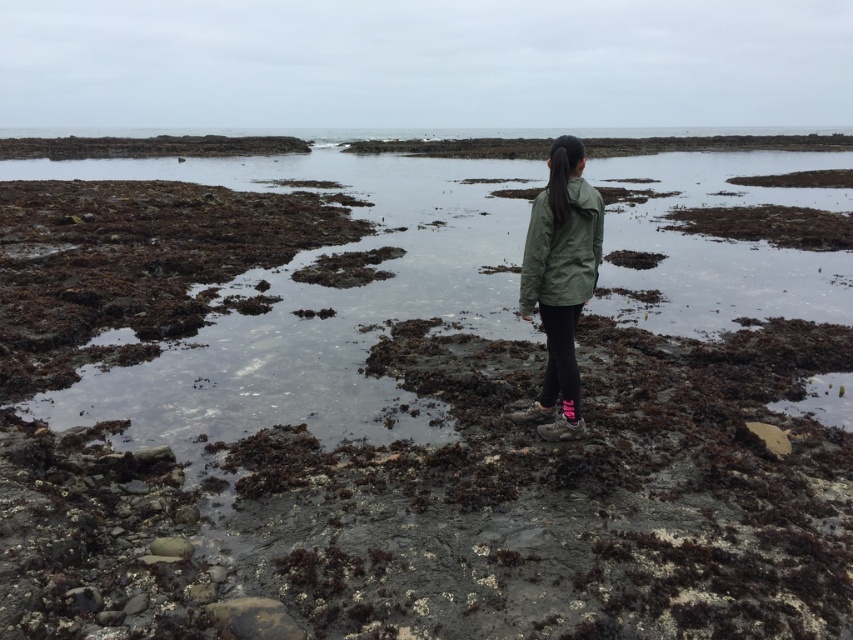
Is point (544, 289) less distant than point (576, 179)?

That is False.

What do you see at coordinates (560, 282) in the screenshot?
I see `green matte jacket at center` at bounding box center [560, 282].

Is point (567, 189) closer to viewer compared to point (575, 204)?

No, (567, 189) is further to viewer.

You are a GUI agent. You are given a task and a screenshot of the screen. Output one action in this format:
    pyautogui.click(x=<x>, y=<y>)
    Task: Click on the green matte jacket at center
    Image resolution: width=853 pixels, height=640 pixels.
    Given the screenshot: What is the action you would take?
    pyautogui.click(x=560, y=282)